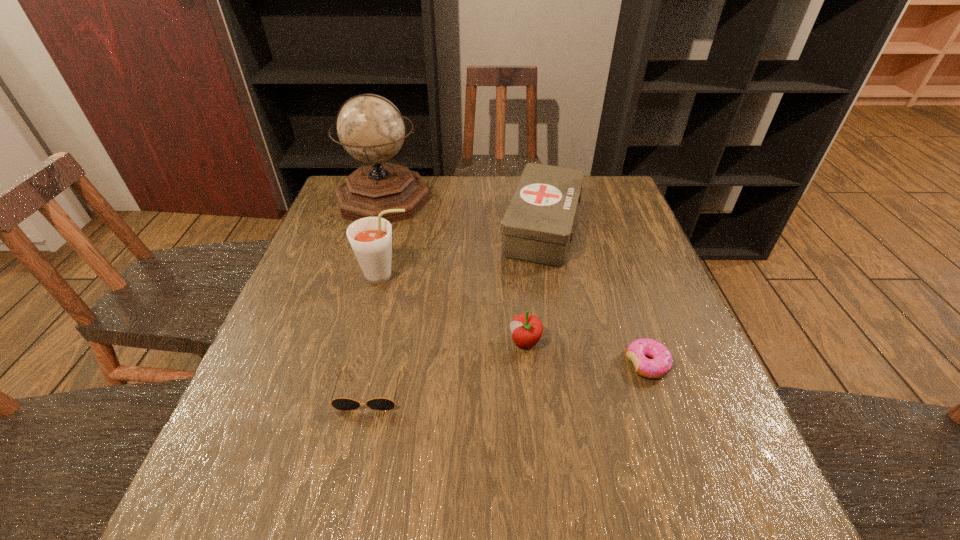
The image size is (960, 540). What are the coordinates of `free space located on the front-facing side of the sunglasses` in the screenshot? It's located at (353, 465).

Identify the location of vacant space situated on the left of the doughnut. (557, 364).

Locate an element on the screen. The image size is (960, 540). globe at the far edge is located at coordinates (370, 128).

Where is `the first-aid kit situated at the far edge`? the first-aid kit situated at the far edge is located at coordinates (537, 225).

At what (x,y) coordinates should I click in order to perform the action: click on globe at the left edge. Please return your answer as a coordinate pair (x, y). The image size is (960, 540). Looking at the image, I should click on (370, 128).

The image size is (960, 540). In order to click on root beer situated at the left edge in this screenshot , I will do `click(370, 238)`.

Identify the location of the first-aid kit that is at the right edge. (537, 225).

Locate an element on the screen. doughnut present at the right edge is located at coordinates (660, 364).

Where is `object positioned at the far left corner`? The image size is (960, 540). object positioned at the far left corner is located at coordinates (370, 128).

I want to click on object located in the far right corner section of the desktop, so click(x=537, y=225).